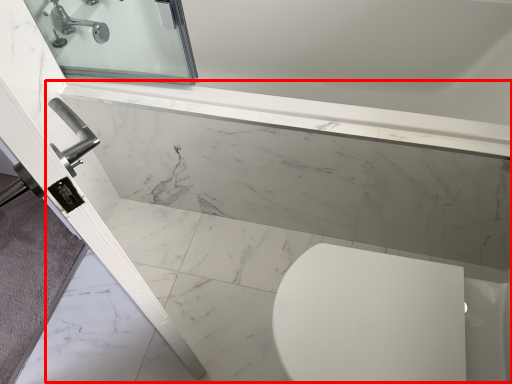
Question: From the image's perspective, where is bath (annotated by the red box) located in relation to tap in the image?

Choices:
 (A) below
 (B) above

Answer: (A)